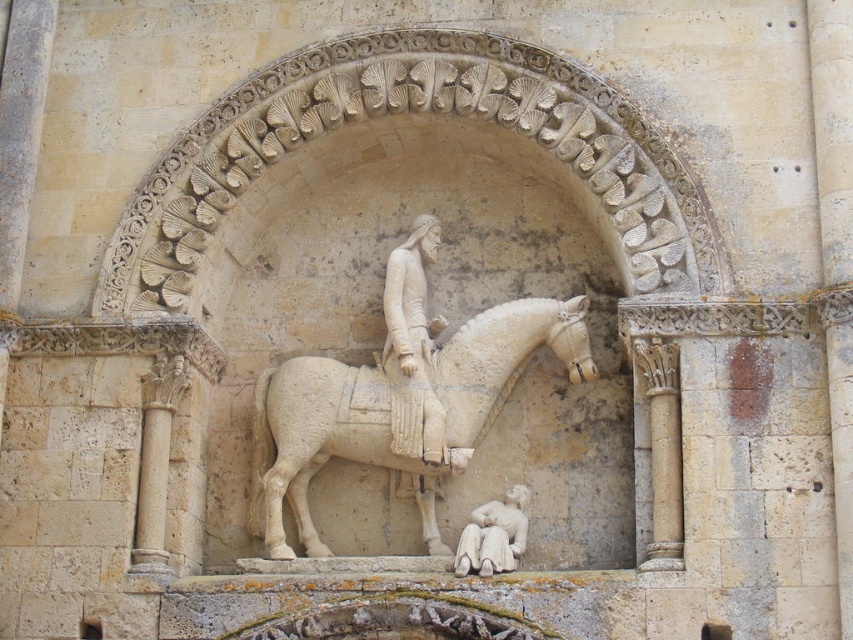
Question: Which of the following is the farthest from the observer?

Choices:
 (A) (448, 442)
 (B) (433, 330)
 (C) (509, 509)

Answer: (B)

Question: Is white stone horse at center wider than white stone statue at center?

Choices:
 (A) yes
 (B) no

Answer: (A)

Question: Which point is closer to the camera taking this photo?

Choices:
 (A) [x=495, y=518]
 (B) [x=497, y=362]
 (C) [x=409, y=269]

Answer: (A)

Question: From the image, what is the correct spatial relationship of white stone horse at center in relation to white stone statue at center?

Choices:
 (A) above
 (B) below

Answer: (B)

Question: Which of the following is the closest to the observer?

Choices:
 (A) (379, 461)
 (B) (421, 364)

Answer: (B)

Question: Is white stone statue at center wider than white stone reclining figure at lower center?

Choices:
 (A) yes
 (B) no

Answer: (A)